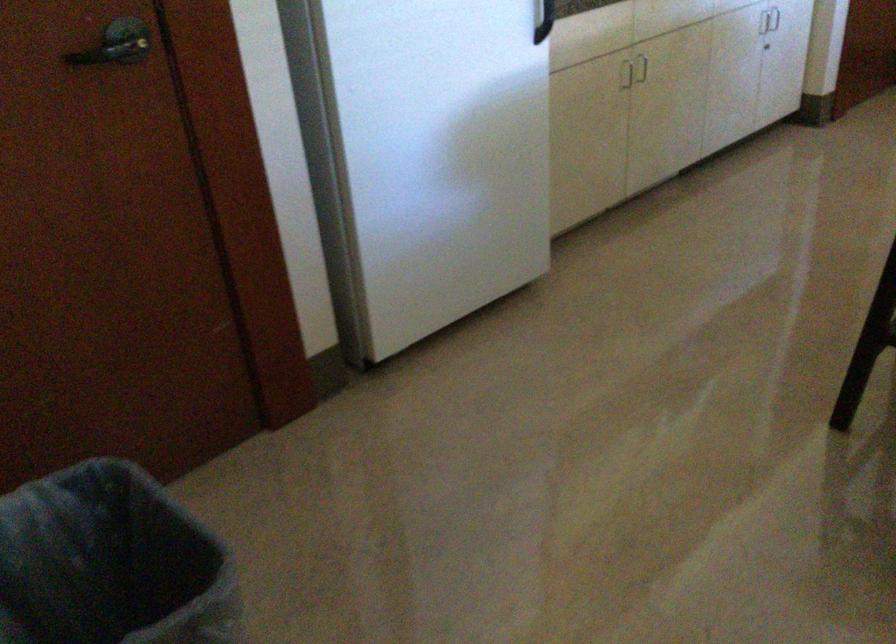
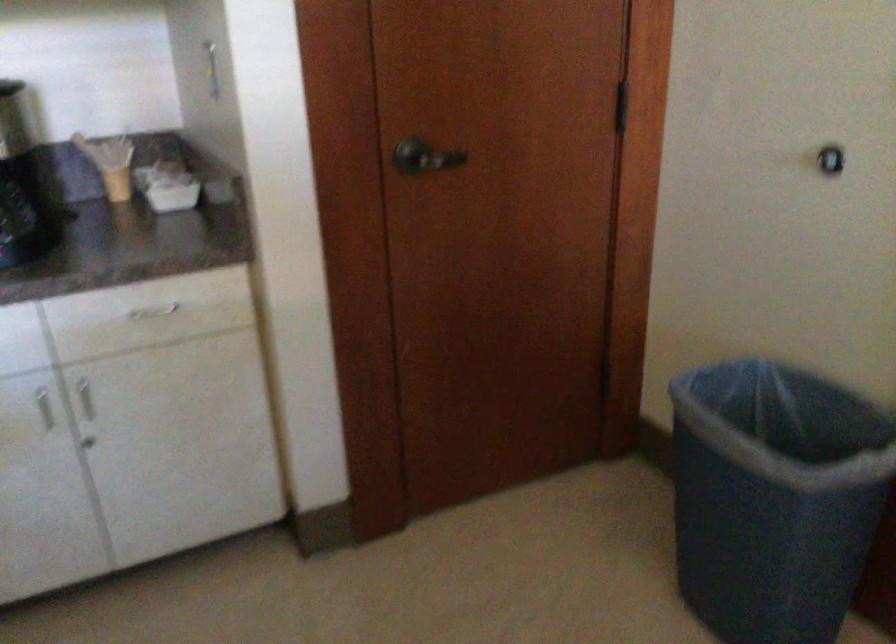
The images are taken continuously from a first-person perspective. In which direction are you moving?

The cameraman moved toward right, forward.